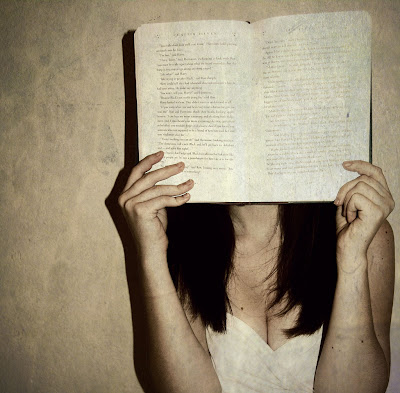
This screenshot has height=393, width=400. I want to click on beige walls, so click(87, 124).